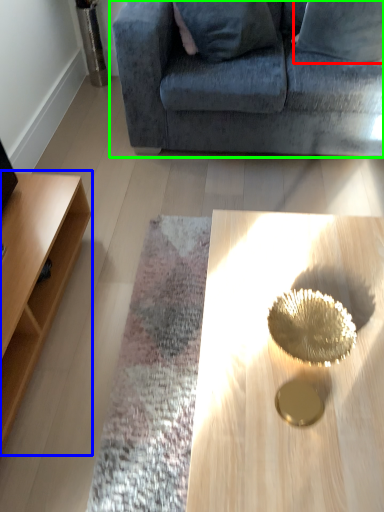
Question: Which object is the farthest from pillow (highlighted by a red box)? Choose among these: table (highlighted by a blue box) or studio couch (highlighted by a green box).

Choices:
 (A) table
 (B) studio couch

Answer: (A)